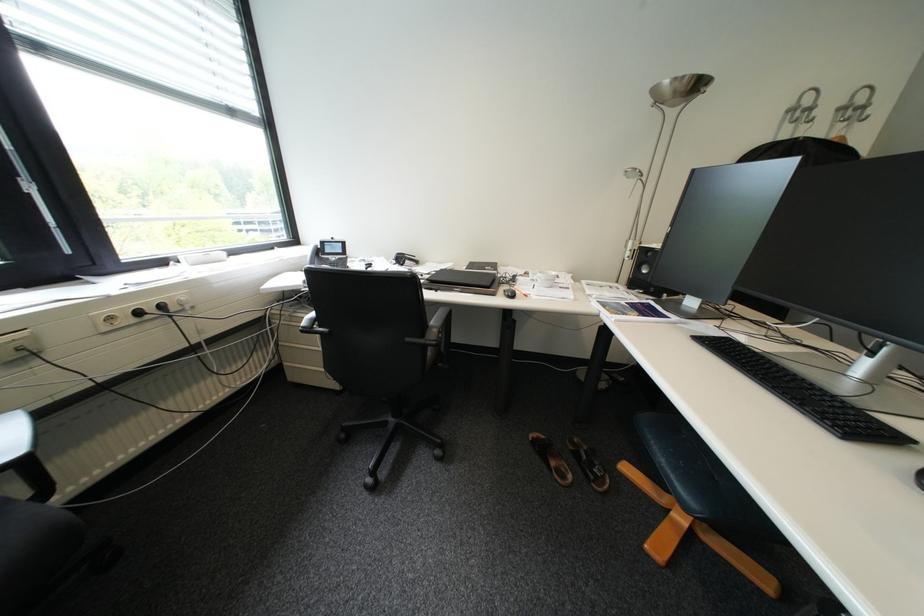
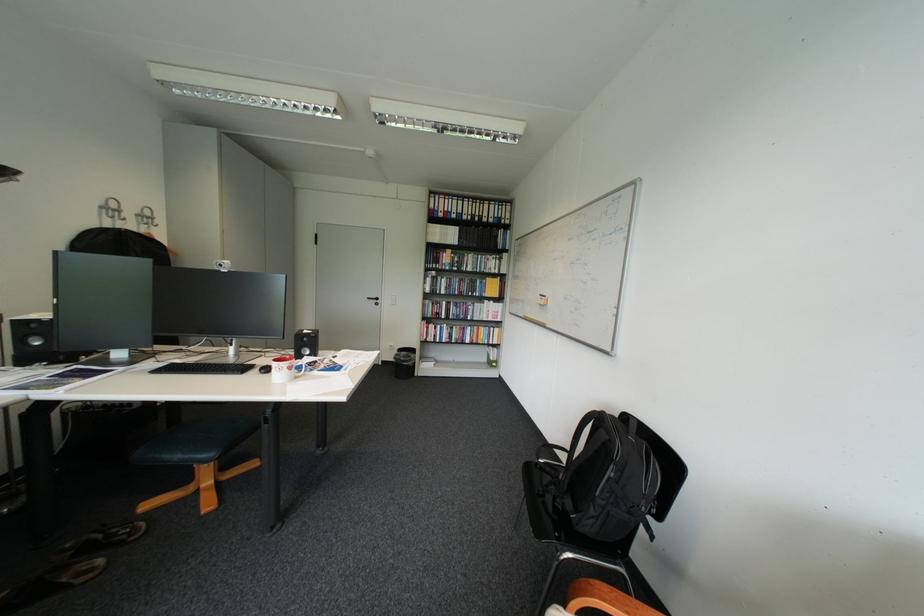
Find the pixel in the second image that matches point 823,121 in the first image.

(137, 220)